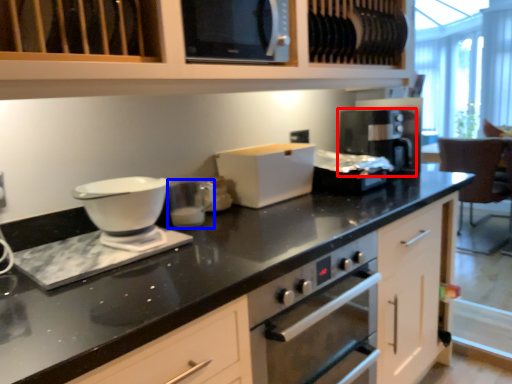
Question: Among these objects, which one is farthest to the camera, coffee machine (highlighted by a red box) or appliance (highlighted by a blue box)?

Choices:
 (A) coffee machine
 (B) appliance

Answer: (A)